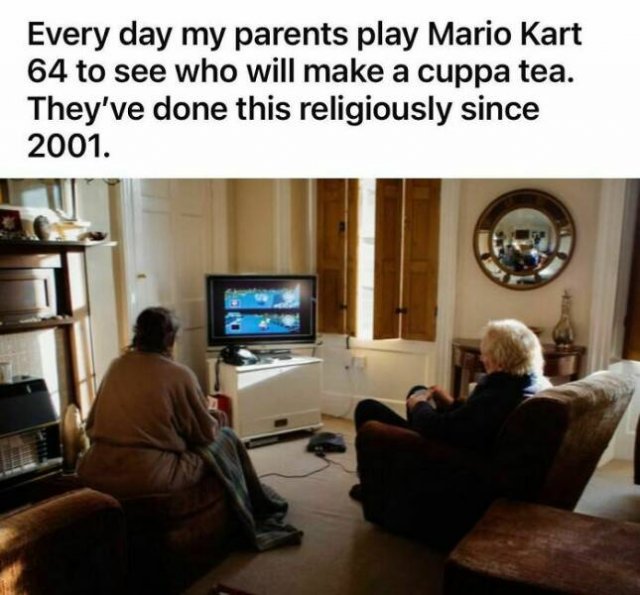
This screenshot has height=595, width=640. I want to click on white door, so click(x=188, y=250).